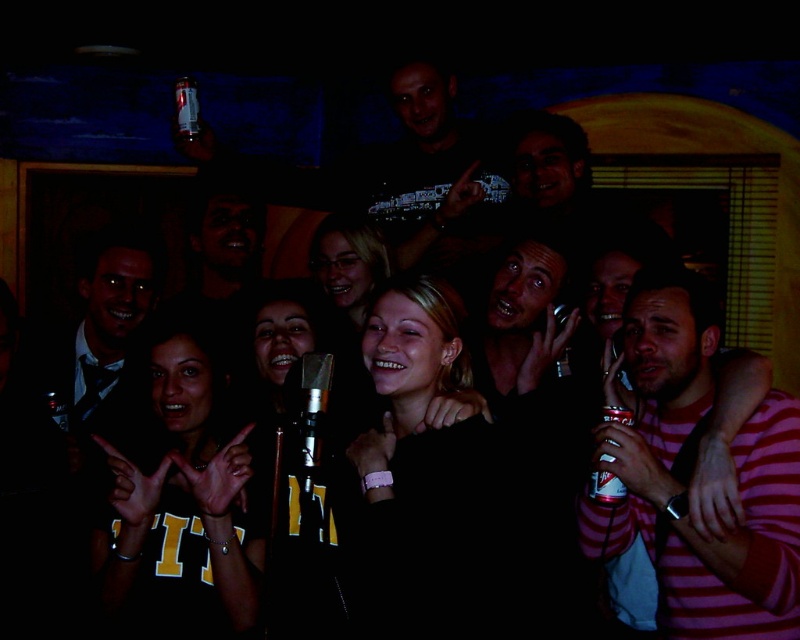
Does matte black suit at left have a greater height compared to smooth blonde hair at center?

Indeed, matte black suit at left has a greater height compared to smooth blonde hair at center.

Can you confirm if matte black suit at left is smaller than smooth blonde hair at center?

Incorrect, matte black suit at left is not smaller in size than smooth blonde hair at center.

Measure the distance between point (52, 333) and camera.

15.64 feet

Where is `matte black suit at left`? matte black suit at left is located at coordinates (100, 324).

Looking at this image, who is shorter, black matte jacket at center or shiny metallic microphone at center?

shiny metallic microphone at center is shorter.

Is black matte jacket at center smaller than shiny metallic microphone at center?

No, black matte jacket at center is not smaller than shiny metallic microphone at center.

Who is more distant from viewer, (420,444) or (312,460)?

Point (420,444)

At what (x,y) coordinates should I click in order to perform the action: click on black matte jacket at center. Please return your answer as a coordinate pair (x, y). The image size is (800, 640). Looking at the image, I should click on (454, 492).

Who is higher up, black matte shirt at center or matte black shirt at center?

Positioned higher is matte black shirt at center.

Consider the image. Is black matte shirt at center shorter than matte black shirt at center?

Incorrect, black matte shirt at center's height does not fall short of matte black shirt at center's.

Find the location of a particular element. This screenshot has width=800, height=640. black matte shirt at center is located at coordinates (180, 508).